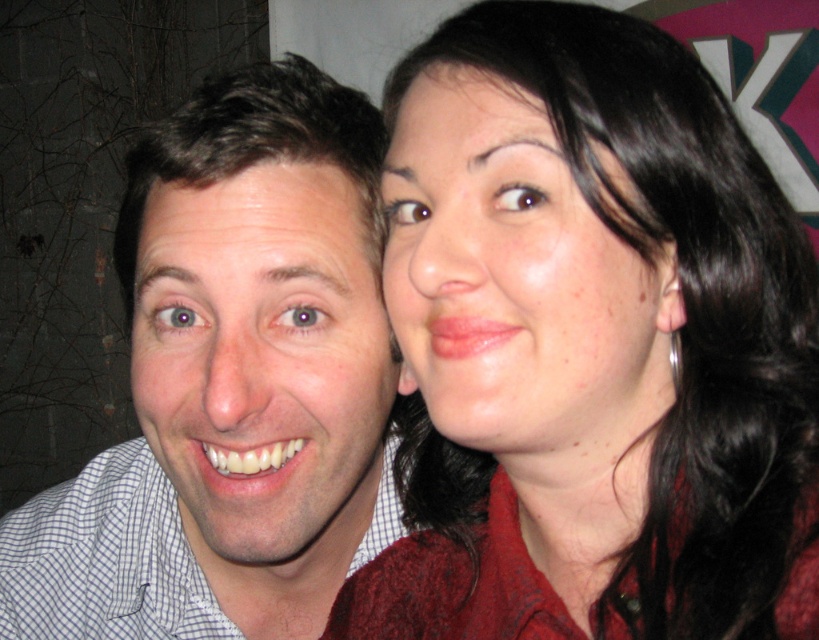
Question: Among these objects, which one is farthest from the camera?

Choices:
 (A) matte skin face at upper right
 (B) white matte face at center
 (C) white checkered shirt at left

Answer: (B)

Question: Can you confirm if white matte face at center is positioned to the right of matte skin face at upper right?

Choices:
 (A) yes
 (B) no

Answer: (B)

Question: Which object appears farthest from the camera in this image?

Choices:
 (A) matte red sweater at upper right
 (B) white checkered shirt at left
 (C) white matte face at center
 (D) silver metallic ring at ear

Answer: (D)

Question: Which of the following is the closest to the observer?

Choices:
 (A) (675, 333)
 (B) (593, 244)
 (C) (183, 566)

Answer: (B)

Question: Is matte skin face at upper right thinner than silver metallic ring at ear?

Choices:
 (A) no
 (B) yes

Answer: (A)

Question: From the image, what is the correct spatial relationship of matte red sweater at upper right in relation to matte skin face at upper right?

Choices:
 (A) above
 (B) below

Answer: (B)